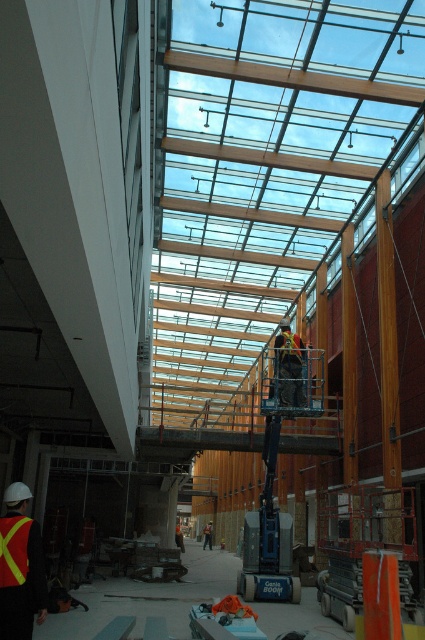
Is point (20, 520) behind point (300, 358)?

No, (20, 520) is closer to viewer.

Does yellow reflective fabric safety vest at lower left appear on the right side of orange reflective safety vest at center?

In fact, yellow reflective fabric safety vest at lower left is to the left of orange reflective safety vest at center.

Which is in front, point (8, 580) or point (300, 346)?

Point (8, 580) is in front.

Where is `yellow reflective fabric safety vest at lower left`? yellow reflective fabric safety vest at lower left is located at coordinates (14, 548).

Consider the image. Does reflective safety vest at center appear on the right side of yellow reflective fabric safety vest at lower left?

Yes, reflective safety vest at center is to the right of yellow reflective fabric safety vest at lower left.

Can you confirm if reflective safety vest at center is shorter than yellow reflective fabric safety vest at lower left?

Yes.

Who is more distant from viewer, (283, 353) or (19, 545)?

Positioned behind is point (283, 353).

You are a GUI agent. You are given a task and a screenshot of the screen. Output one action in this format:
    pyautogui.click(x=<x>, y=<y>)
    Task: Click on the reflective safety vest at center
    The height and width of the screenshot is (640, 425).
    Given the screenshot: What is the action you would take?
    pyautogui.click(x=289, y=365)

Measure the distance between point (300,349) and camera.

18.16 meters

Which is behind, point (280, 333) or point (297, 339)?

The point (297, 339) is more distant.

Is point (297, 403) closer to camera compared to point (286, 358)?

Yes.

The width and height of the screenshot is (425, 640). In order to click on reflective safety vest at center in this screenshot , I will do `click(289, 365)`.